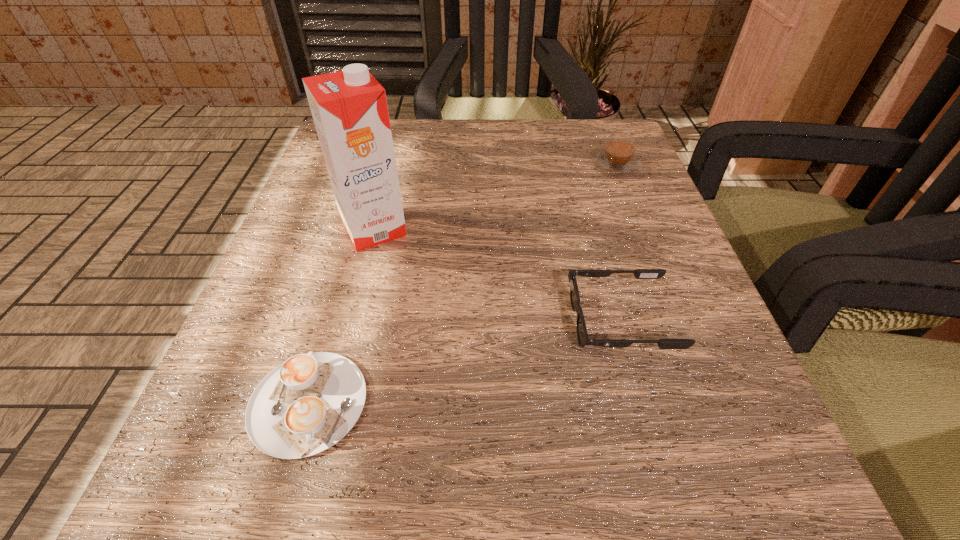
You are a GUI agent. You are given a task and a screenshot of the screen. Output one action in this format:
    pyautogui.click(x=<x>, y=<y>)
    Task: Click on the vacant area that lies between the third nearest object and the sunglasses
    
    Given the screenshot: What is the action you would take?
    pyautogui.click(x=497, y=275)

At what (x,y) coordinates should I click in order to perform the action: click on vacant space that is in between the second tallest object and the shortest object. Please return your answer as a coordinate pair (x, y). Looking at the image, I should click on (462, 285).

Image resolution: width=960 pixels, height=540 pixels. In order to click on free spot between the taller cappuccino and the shortest object in this screenshot , I will do `click(462, 285)`.

I want to click on free space between the left cappuccino and the sunglasses, so (465, 362).

Find the location of a particular element. The height and width of the screenshot is (540, 960). empty location between the nearer cappuccino and the sunglasses is located at coordinates (465, 362).

At what (x,y) coordinates should I click in order to perform the action: click on free space between the shorter cappuccino and the taller cappuccino. Please return your answer as a coordinate pair (x, y). Looking at the image, I should click on (462, 285).

The height and width of the screenshot is (540, 960). I want to click on vacant space in between the third tallest object and the second farthest object, so click(497, 275).

This screenshot has width=960, height=540. Find the location of `free space between the third tallest object and the right cappuccino`. free space between the third tallest object and the right cappuccino is located at coordinates (618, 244).

This screenshot has height=540, width=960. Identify the location of object that is the third closest to the carton. (618, 159).

Locate an element on the screen. object that is the second closest to the third nearest object is located at coordinates (582, 335).